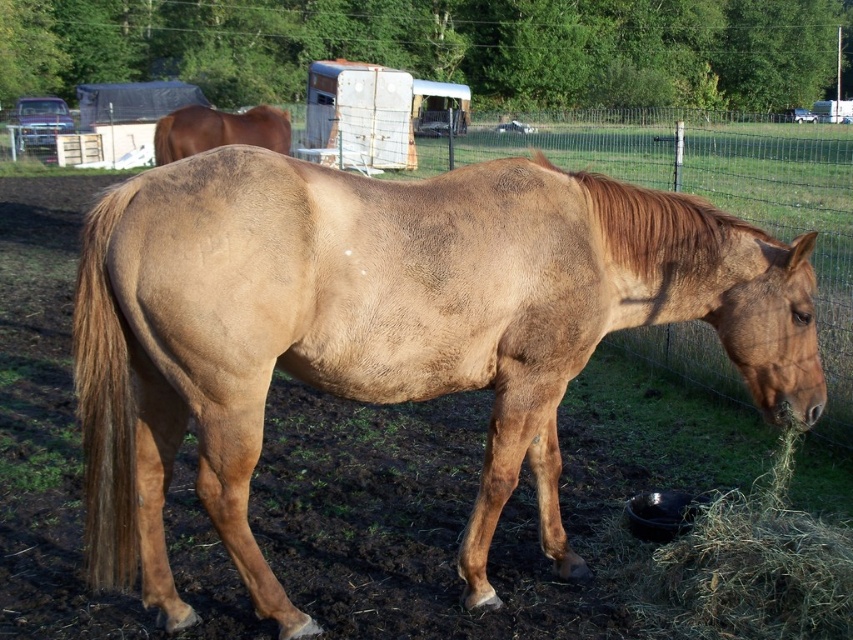
Question: Which object is farther from the camera taking this photo?

Choices:
 (A) brown matte horse at upper left
 (B) brown matte horse at center

Answer: (A)

Question: Which object appears farthest from the camera in this image?

Choices:
 (A) brown matte horse at upper left
 (B) green straw at lower right
 (C) brown matte horse at center

Answer: (A)

Question: Can you confirm if green straw at lower right is positioned to the right of brown matte horse at upper left?

Choices:
 (A) no
 (B) yes

Answer: (B)

Question: Is brown matte horse at center closer to camera compared to green straw at lower right?

Choices:
 (A) no
 (B) yes

Answer: (B)

Question: Is brown matte horse at center to the right of brown matte horse at upper left from the viewer's perspective?

Choices:
 (A) no
 (B) yes

Answer: (B)

Question: Which of these objects is positioned farthest from the green straw at lower right?

Choices:
 (A) brown matte horse at center
 (B) brown matte horse at upper left

Answer: (B)